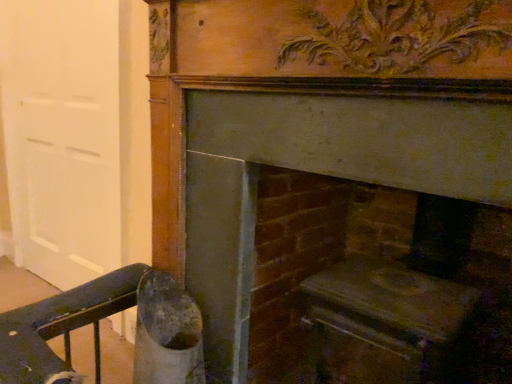
Question: In terms of height, does smooth stone hearth at center, which is the 2th fireplace in left-to-right order, look taller or shorter compared to wooden fireplace at center, marked as the 1th fireplace in a left-to-right arrangement?

Choices:
 (A) short
 (B) tall

Answer: (A)

Question: Based on their sizes in the image, would you say smooth stone hearth at center, positioned as the first fireplace in right-to-left order, is bigger or smaller than wooden fireplace at center, the second fireplace viewed from the right?

Choices:
 (A) big
 (B) small

Answer: (A)

Question: Which of these objects is positioned farthest from the wooden fireplace at center, marked as the 1th fireplace in a left-to-right arrangement?

Choices:
 (A) white matte door at left
 (B) smooth stone hearth at center, positioned as the first fireplace in right-to-left order

Answer: (A)

Question: Estimate the real-world distances between objects in this image. Which object is farther from the wooden fireplace at center, the second fireplace viewed from the right?

Choices:
 (A) smooth stone hearth at center, which is the 2th fireplace in left-to-right order
 (B) white matte door at left

Answer: (B)